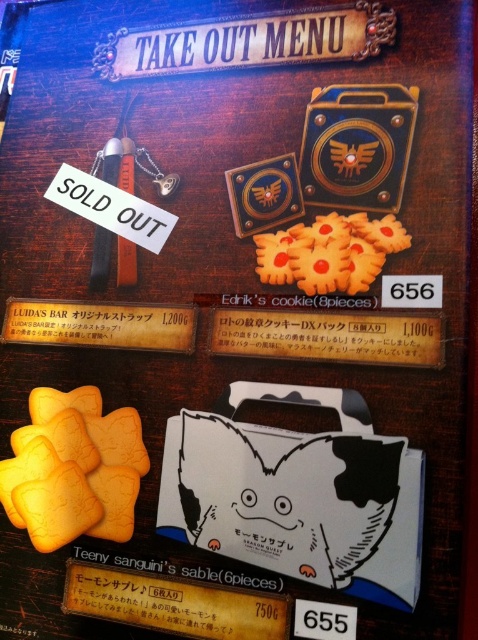
Does matte gold cookie at center appear on the right side of wooden sign at center?

Correct, you'll find matte gold cookie at center to the right of wooden sign at center.

Does matte gold cookie at center appear over wooden sign at center?

Actually, matte gold cookie at center is below wooden sign at center.

Is point (319, 321) positioned after point (188, 305)?

No, it is not.

Locate an element on the screen. The image size is (478, 640). matte gold cookie at center is located at coordinates (328, 337).

Can you confirm if yellow matte biscuit at center is bigger than wooden sign at center?

Yes.

Is yellow matte biscuit at center to the right of wooden sign at center from the viewer's perspective?

No, yellow matte biscuit at center is not to the right of wooden sign at center.

Is point (68, 541) farther from camera compared to point (34, 340)?

No, it is not.

Find the location of a particular element. yellow matte biscuit at center is located at coordinates click(74, 468).

Does yellow matte biscuit at center have a smaller size compared to matte gold cookie at center?

Actually, yellow matte biscuit at center might be larger than matte gold cookie at center.

Does yellow matte biscuit at center appear on the right side of matte gold cookie at center?

No, yellow matte biscuit at center is not to the right of matte gold cookie at center.

Does point (71, 429) come closer to viewer compared to point (425, 323)?

No, it is not.

This screenshot has width=478, height=640. In order to click on yellow matte biscuit at center in this screenshot , I will do `click(74, 468)`.